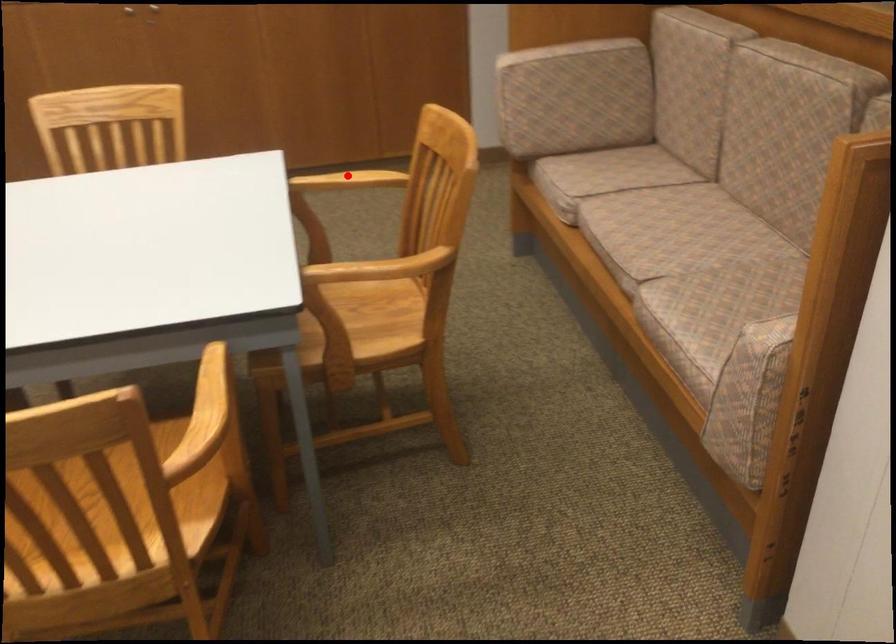
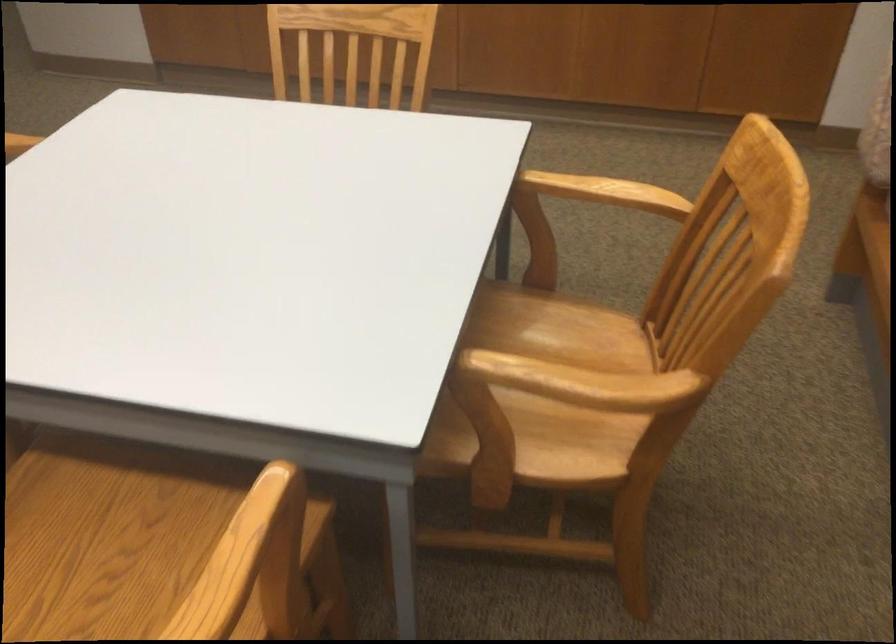
Where in the second image is the point corresponding to the highlighted location from the first image?

(605, 192)